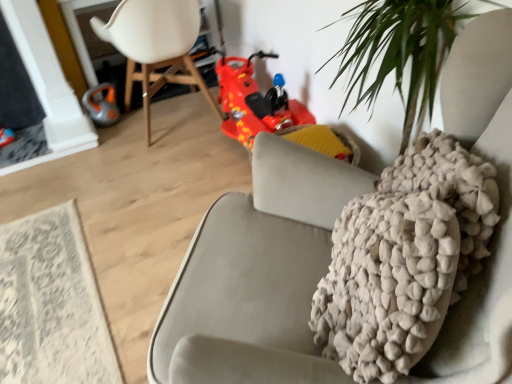
Locate an element on the screen. free location above white textured rug at lower left (from a real-world perspective) is located at coordinates (47, 294).